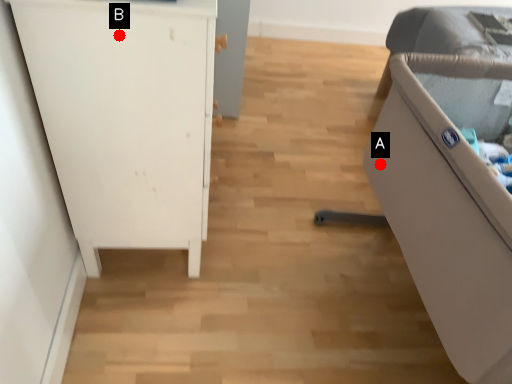
Question: Two points are circled on the image, labeled by A and B beside each circle. Which point is further to the camera?

Choices:
 (A) A is further
 (B) B is further

Answer: (A)